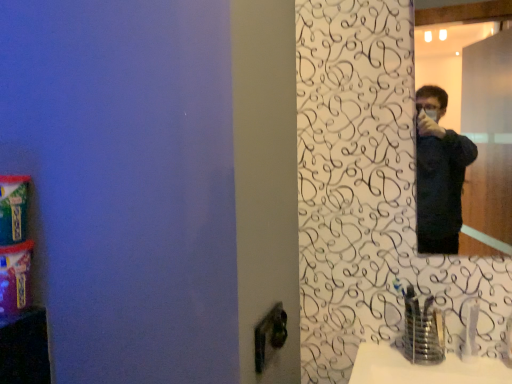
I want to click on black matte mirror at upper right, so click(488, 144).

Locate an element on the screen. satin nickel faucet at lower right, the second faucet positioned from the right is located at coordinates (422, 329).

Who is bigger, white plastic faucet at lower right, which is counted as the second faucet, starting from the left, or black matte mirror at upper right?

black matte mirror at upper right is bigger.

Is point (471, 327) farther from viewer compared to point (508, 76)?

No.

From a real-world perspective, is white plastic faucet at lower right, which is the 1th faucet from right to left, on top of black matte mirror at upper right?

Actually, white plastic faucet at lower right, which is the 1th faucet from right to left, is physically below black matte mirror at upper right in the real world.

Which object is thinner, satin nickel faucet at lower right, the first faucet in the left-to-right sequence, or black matte mirror at upper right?

black matte mirror at upper right.

From the image's perspective, is satin nickel faucet at lower right, the first faucet in the left-to-right sequence, located above black matte mirror at upper right?

No, from the image's perspective, satin nickel faucet at lower right, the first faucet in the left-to-right sequence, is not on top of black matte mirror at upper right.

From a real-world perspective, who is located higher, satin nickel faucet at lower right, the first faucet in the left-to-right sequence, or black matte mirror at upper right?

black matte mirror at upper right is physically above.

Between satin nickel faucet at lower right, the first faucet in the left-to-right sequence, and white plastic faucet at lower right, which is counted as the second faucet, starting from the left, which one has smaller size?

white plastic faucet at lower right, which is counted as the second faucet, starting from the left.

In the image, there is a satin nickel faucet at lower right, the second faucet positioned from the right. Where is `faucet below it (from the image's perspective)`? The width and height of the screenshot is (512, 384). faucet below it (from the image's perspective) is located at coordinates (469, 329).

From a real-world perspective, is satin nickel faucet at lower right, the second faucet positioned from the right, physically located above or below white plastic faucet at lower right, which is counted as the second faucet, starting from the left?

satin nickel faucet at lower right, the second faucet positioned from the right, is above white plastic faucet at lower right, which is counted as the second faucet, starting from the left.

Do you think black matte mirror at upper right is within satin nickel faucet at lower right, the second faucet positioned from the right, or outside of it?

black matte mirror at upper right cannot be found inside satin nickel faucet at lower right, the second faucet positioned from the right.

Between black matte mirror at upper right and satin nickel faucet at lower right, the second faucet positioned from the right, which one appears on the right side from the viewer's perspective?

From the viewer's perspective, black matte mirror at upper right appears more on the right side.

Is black matte mirror at upper right aimed at satin nickel faucet at lower right, the first faucet in the left-to-right sequence?

No, black matte mirror at upper right does not turn towards satin nickel faucet at lower right, the first faucet in the left-to-right sequence.

Is the position of black matte mirror at upper right less distant than that of satin nickel faucet at lower right, the second faucet positioned from the right?

No, it is not.

From the image's perspective, which one is positioned higher, black matte mirror at upper right or white plastic faucet at lower right, which is the 1th faucet from right to left?

black matte mirror at upper right, from the image's perspective.

Could you tell me if black matte mirror at upper right is turned towards white plastic faucet at lower right, which is counted as the second faucet, starting from the left?

No.

Is black matte mirror at upper right in front of white plastic faucet at lower right, which is the 1th faucet from right to left?

Yes, black matte mirror at upper right is closer to the camera.

Find the location of a particular element. Image resolution: width=512 pixels, height=384 pixels. mirror located above the white plastic faucet at lower right, which is counted as the second faucet, starting from the left (from a real-world perspective) is located at coordinates (488, 144).

Which object is wider, white plastic faucet at lower right, which is the 1th faucet from right to left, or satin nickel faucet at lower right, the first faucet in the left-to-right sequence?

satin nickel faucet at lower right, the first faucet in the left-to-right sequence, is wider.

Based on the photo, considering the sizes of objects white plastic faucet at lower right, which is counted as the second faucet, starting from the left, and satin nickel faucet at lower right, the first faucet in the left-to-right sequence, in the image provided, who is bigger, white plastic faucet at lower right, which is counted as the second faucet, starting from the left, or satin nickel faucet at lower right, the first faucet in the left-to-right sequence,?

Bigger between the two is satin nickel faucet at lower right, the first faucet in the left-to-right sequence.

Relative to satin nickel faucet at lower right, the first faucet in the left-to-right sequence, is white plastic faucet at lower right, which is counted as the second faucet, starting from the left, in front or behind?

In the image, white plastic faucet at lower right, which is counted as the second faucet, starting from the left, appears behind satin nickel faucet at lower right, the first faucet in the left-to-right sequence.

At what (x,y) coordinates should I click in order to perform the action: click on faucet behind the black matte mirror at upper right. Please return your answer as a coordinate pair (x, y). The width and height of the screenshot is (512, 384). Looking at the image, I should click on (469, 329).

This screenshot has width=512, height=384. Identify the location of faucet on the left of black matte mirror at upper right. (422, 329).

When comparing their distances from black matte mirror at upper right, does satin nickel faucet at lower right, the first faucet in the left-to-right sequence, or white plastic faucet at lower right, which is counted as the second faucet, starting from the left, seem closer?

The object closer to black matte mirror at upper right is satin nickel faucet at lower right, the first faucet in the left-to-right sequence.

When comparing their distances from satin nickel faucet at lower right, the first faucet in the left-to-right sequence, does white plastic faucet at lower right, which is counted as the second faucet, starting from the left, or black matte mirror at upper right seem further?

Based on the image, black matte mirror at upper right appears to be further to satin nickel faucet at lower right, the first faucet in the left-to-right sequence.

Based on their spatial positions, is white plastic faucet at lower right, which is the 1th faucet from right to left, or satin nickel faucet at lower right, the first faucet in the left-to-right sequence, further from black matte mirror at upper right?

white plastic faucet at lower right, which is the 1th faucet from right to left, is positioned further to the anchor black matte mirror at upper right.

Based on their spatial positions, is black matte mirror at upper right or satin nickel faucet at lower right, the first faucet in the left-to-right sequence, further from white plastic faucet at lower right, which is the 1th faucet from right to left?

black matte mirror at upper right lies further to white plastic faucet at lower right, which is the 1th faucet from right to left, than the other object.

Based on their spatial positions, is black matte mirror at upper right or white plastic faucet at lower right, which is counted as the second faucet, starting from the left, closer to satin nickel faucet at lower right, the first faucet in the left-to-right sequence?

white plastic faucet at lower right, which is counted as the second faucet, starting from the left, is positioned closer to the anchor satin nickel faucet at lower right, the first faucet in the left-to-right sequence.

From the image, which object appears to be nearer to white plastic faucet at lower right, which is counted as the second faucet, starting from the left, satin nickel faucet at lower right, the first faucet in the left-to-right sequence, or black matte mirror at upper right?

Based on the image, satin nickel faucet at lower right, the first faucet in the left-to-right sequence, appears to be nearer to white plastic faucet at lower right, which is counted as the second faucet, starting from the left.

Image resolution: width=512 pixels, height=384 pixels. I want to click on faucet between black matte mirror at upper right and white plastic faucet at lower right, which is the 1th faucet from right to left, in the up-down direction, so click(422, 329).